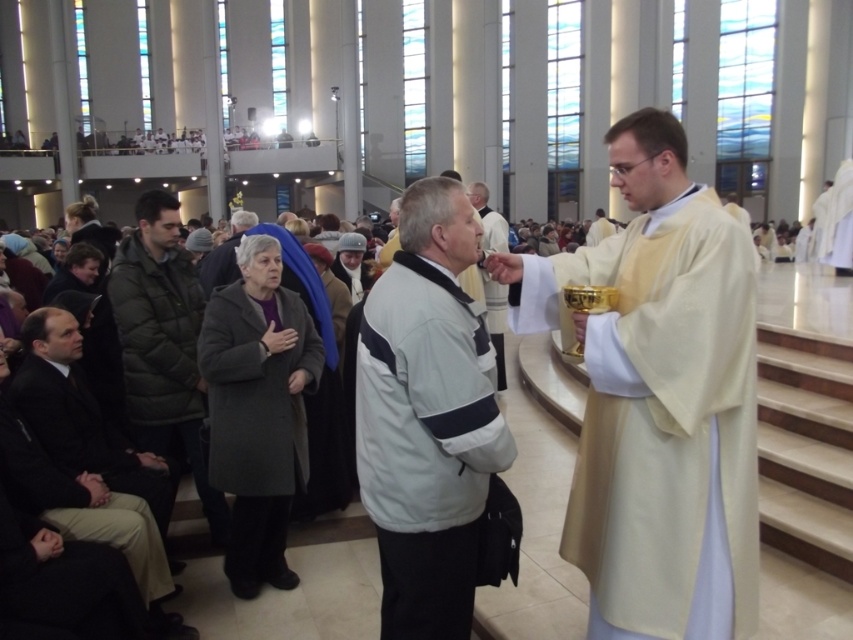
Question: Can you confirm if gray fabric jacket at center is smaller than gray woolen coat at center?

Choices:
 (A) no
 (B) yes

Answer: (A)

Question: Which point is farther to the camera?

Choices:
 (A) (216, 291)
 (B) (428, 275)

Answer: (A)

Question: Among these points, which one is nearest to the camera?

Choices:
 (A) (730, 250)
 (B) (175, 317)

Answer: (A)

Question: Does green quilted jacket at left appear under white matte jacket at center?

Choices:
 (A) no
 (B) yes

Answer: (B)

Question: Which point is closer to the camera?

Choices:
 (A) gray fabric jacket at center
 (B) light beige fabric robe at right
 (C) white matte jacket at center
 (D) green quilted jacket at left

Answer: (B)

Question: Observing the image, what is the correct spatial positioning of light beige fabric robe at right in reference to gray woolen coat at center?

Choices:
 (A) right
 (B) left

Answer: (A)